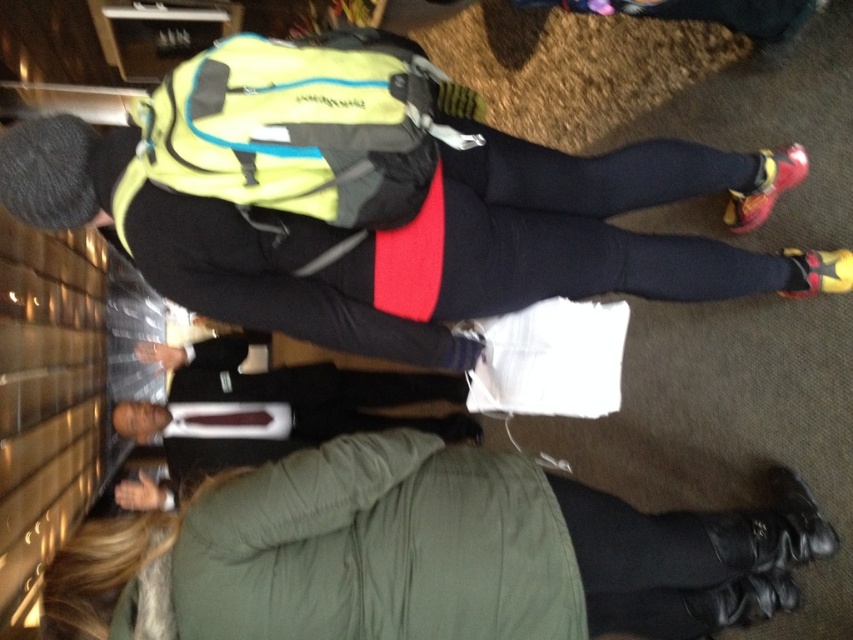
You are standing at the point marked as point (424, 554) in the image. What object is located exactly at this point?

The green textured coat at lower center is located exactly at point (424, 554).